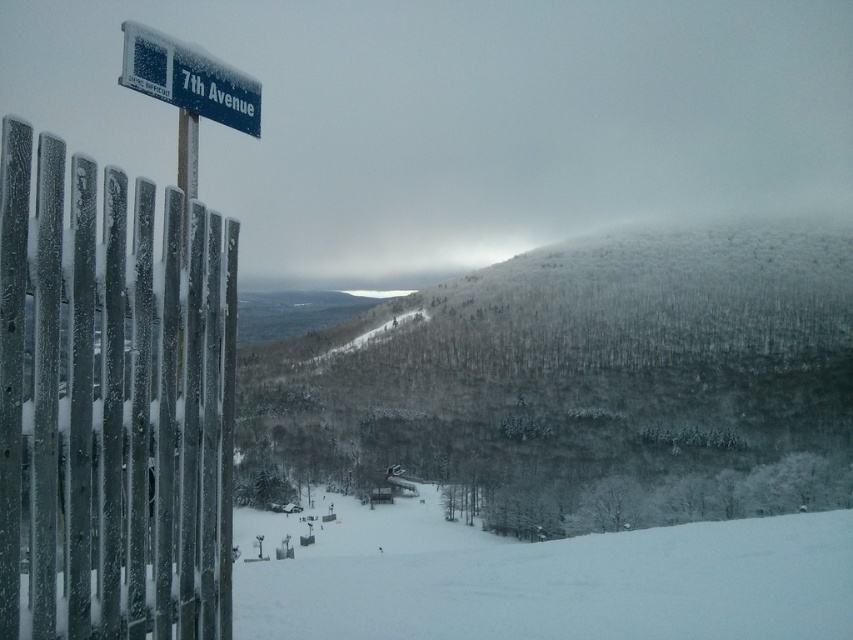
Question: Can you confirm if white snow ski slope at center is wider than blue plastic street sign at upper left?

Choices:
 (A) yes
 (B) no

Answer: (A)

Question: Does snow-covered forest at center appear on the right side of wet wood fence at left?

Choices:
 (A) no
 (B) yes

Answer: (B)

Question: Can you confirm if snow-covered forest at center is positioned to the right of blue plastic street sign at upper left?

Choices:
 (A) no
 (B) yes

Answer: (B)

Question: Which object is farther from the camera taking this photo?

Choices:
 (A) blue plastic street sign at upper left
 (B) wet wood fence at left

Answer: (A)

Question: Which is farther from the snow-covered forest at center?

Choices:
 (A) white snow ski slope at center
 (B) blue plastic street sign at upper left

Answer: (B)

Question: Which of the following is the closest to the observer?

Choices:
 (A) (689, 264)
 (B) (838, 605)

Answer: (B)